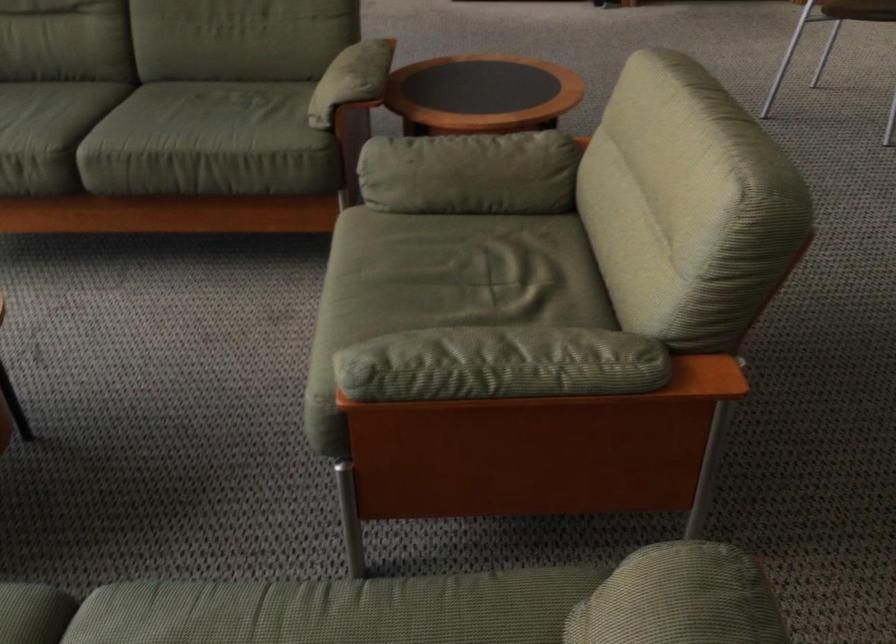
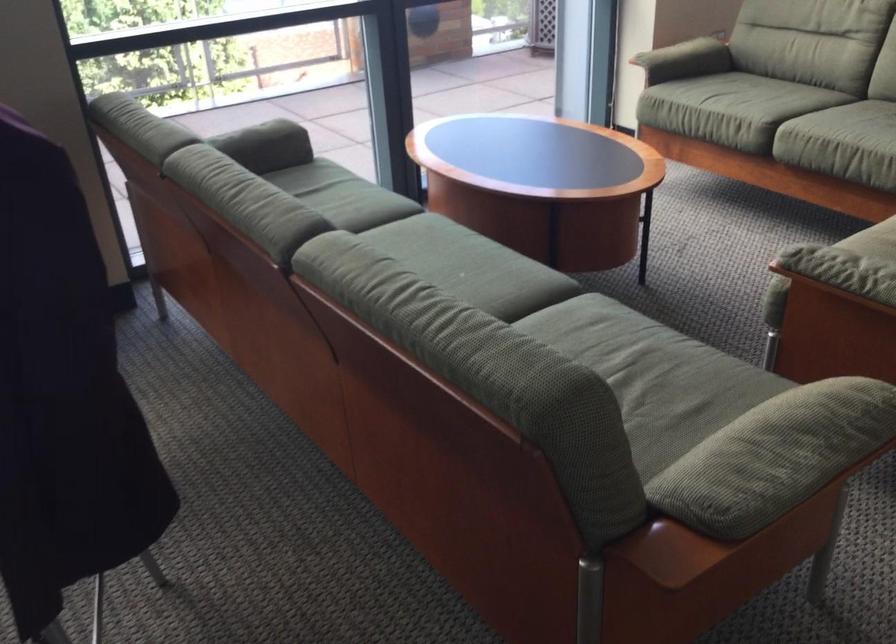
Find the pixel in the second image that matches (437,368) in the first image.

(834, 263)